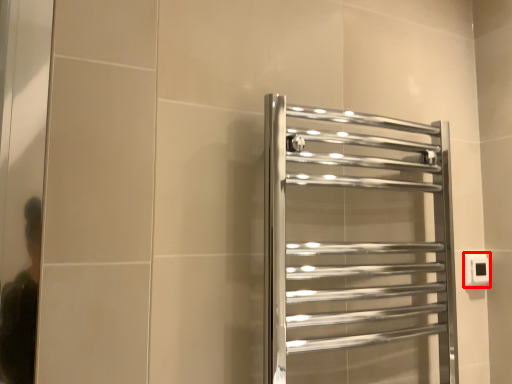
Question: From the image's perspective, where is electric outlet (annotated by the red box) located relative to towel rack?

Choices:
 (A) above
 (B) below

Answer: (B)